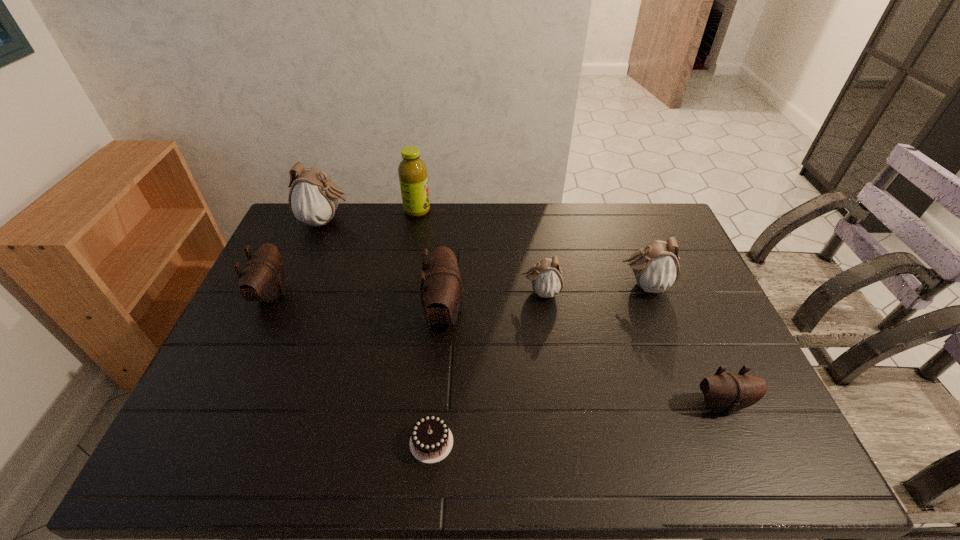
Where is `the rightmost brown pouch`? the rightmost brown pouch is located at coordinates (729, 392).

I want to click on chocolate cake, so click(431, 441).

Locate an element on the screen. the nearest object is located at coordinates (431, 441).

In order to click on free space located 0.350m on the front label of the third object from left to right in this screenshot , I will do `click(523, 211)`.

Find the location of a particular element. This screenshot has width=960, height=540. vacant space located 0.160m on the front-facing side of the biggest white pouch is located at coordinates (397, 221).

This screenshot has width=960, height=540. What are the coordinates of `vacant space located with the flap open on the second brown pouch from right to left` in the screenshot? It's located at (494, 313).

Locate an element on the screen. The height and width of the screenshot is (540, 960). vacant point located 0.180m on the front-facing side of the second biggest white pouch is located at coordinates (560, 285).

Where is `free space located 0.100m on the front-facing side of the second biggest white pouch`? The width and height of the screenshot is (960, 540). free space located 0.100m on the front-facing side of the second biggest white pouch is located at coordinates (586, 285).

The image size is (960, 540). I want to click on vacant area situated on the front-facing side of the second biggest white pouch, so pos(490,285).

You are a GUI agent. You are given a task and a screenshot of the screen. Output one action in this format:
    pyautogui.click(x=<x>, y=<y>)
    Task: Click on the free spot located 0.330m with the flap open on the leftmost brown pouch
    The height and width of the screenshot is (540, 960).
    Given the screenshot: What is the action you would take?
    pyautogui.click(x=395, y=294)